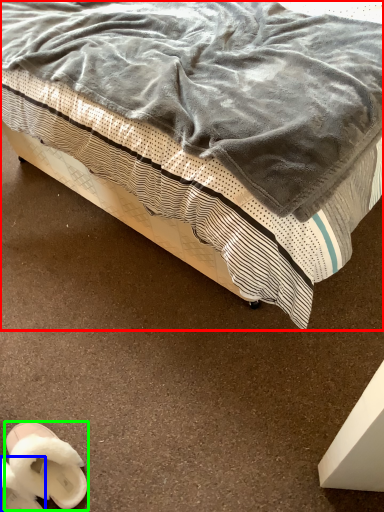
Question: Which object is positioned farthest from bed (highlighted by a red box)? Select from footwear (highlighted by a blue box) and footwear (highlighted by a green box).

Choices:
 (A) footwear
 (B) footwear

Answer: (A)